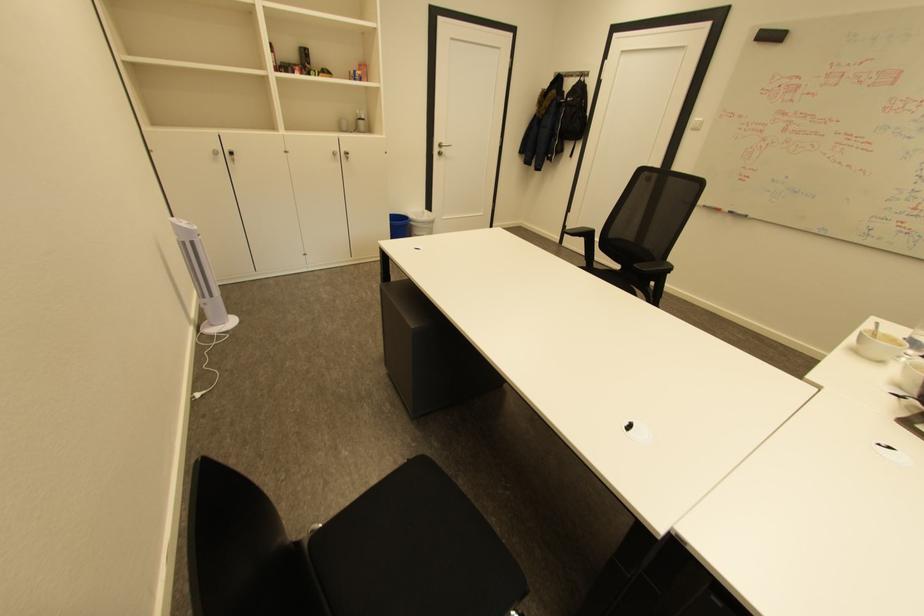
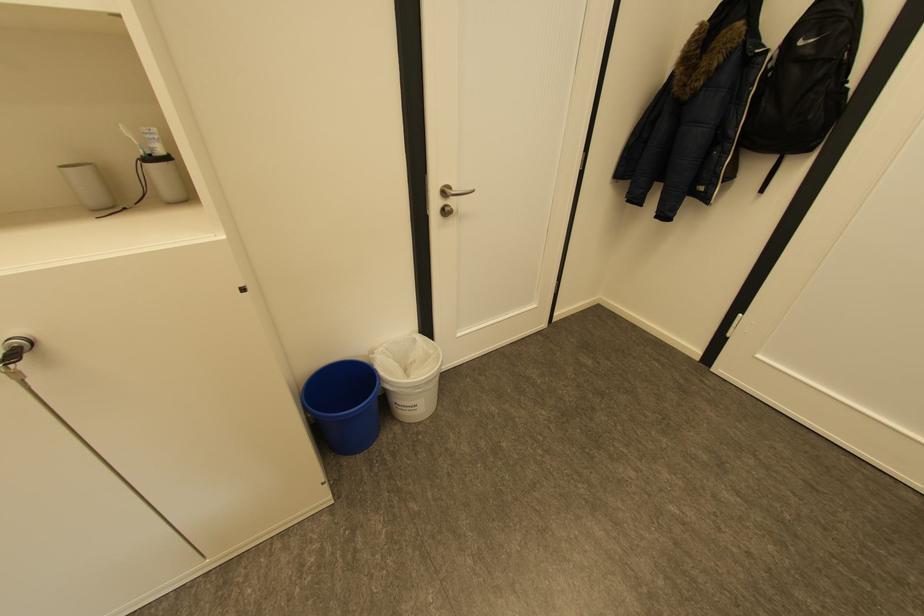
Locate, in the second image, the point that corresponds to point (446, 146) in the first image.

(451, 192)